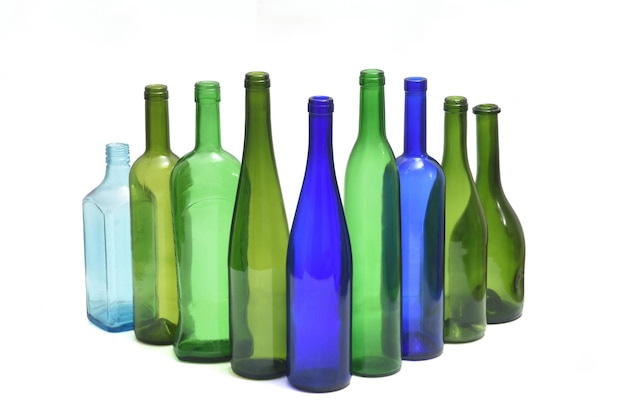
Locate an element on the screen. This screenshot has width=626, height=417. glass bottles is located at coordinates (108, 245), (154, 246), (198, 248), (262, 266), (326, 286), (369, 278), (421, 273), (458, 263), (503, 256).